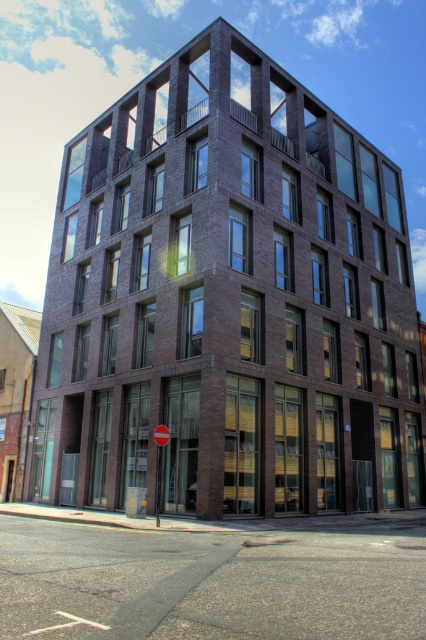
You are a pedestrian standing on the sidewalk in front of the building. You see the yellow plastic street sign at lower center and the red glossy circle at center. Which object is positioned to the right of the other?

The yellow plastic street sign at lower center is to the right of the red glossy circle at center.

You are standing at the corner of the street where the modern multi story building is located. You need to locate the yellow plastic street sign at lower center. According to the coordinates provided, where exactly would you find it?

The yellow plastic street sign at lower center is located at point [158,461].

You are a pedestrian standing on the sidewalk in front of the building. You notice the yellow plastic street sign at lower center and the red glossy circle at center. Which object is nearer to you?

The yellow plastic street sign at lower center is closer to the viewer than the red glossy circle at center.